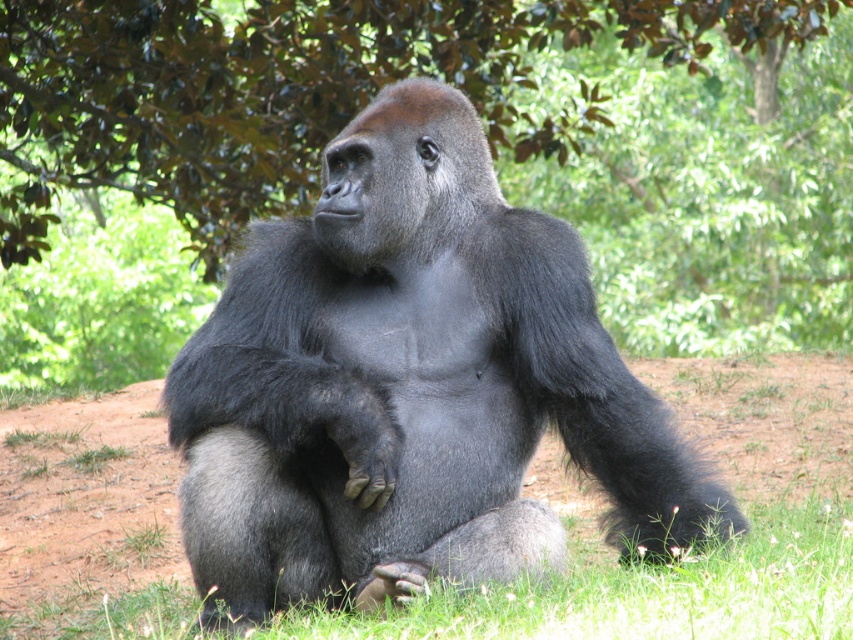
Question: Is green leafy tree at upper center smaller than dark gray fur gorilla at center?

Choices:
 (A) yes
 (B) no

Answer: (A)

Question: Which object is closer to the camera taking this photo?

Choices:
 (A) green leafy tree at upper center
 (B) brown soil at center

Answer: (B)

Question: Observing the image, what is the correct spatial positioning of green leafy tree at upper center in reference to brown soil at center?

Choices:
 (A) above
 (B) below

Answer: (A)

Question: Which of these objects is positioned closest to the green leafy tree at upper center?

Choices:
 (A) dark gray fur gorilla at center
 (B) brown soil at center

Answer: (B)

Question: Does dark gray fur gorilla at center have a smaller size compared to brown soil at center?

Choices:
 (A) no
 (B) yes

Answer: (A)

Question: Considering the real-world distances, which object is closest to the green leafy tree at upper center?

Choices:
 (A) dark gray fur gorilla at center
 (B) brown soil at center

Answer: (B)